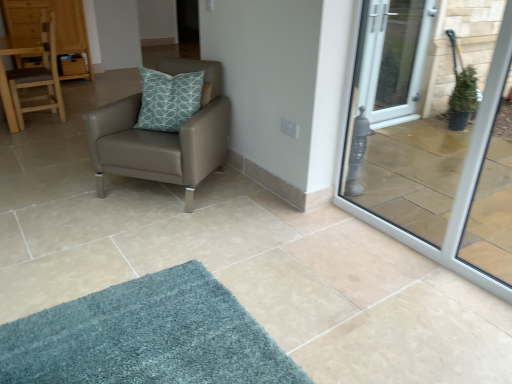
Describe the element at coordinates (31, 76) in the screenshot. I see `light brown wooden chair at left, the first chair in the left-to-right sequence` at that location.

Locate an element on the screen. wooden drawer at upper left is located at coordinates (73, 66).

Find the location of a particular element. matte brown leather chair at center, which appears as the second chair when viewed from the left is located at coordinates (162, 136).

Find the location of a particular element. This screenshot has width=512, height=384. transparent glass door at right is located at coordinates (460, 180).

In order to face transparent glass door at right, should I rotate leftwards or rightwards?

To face it directly, rotate right by 22.376 degrees.

Where is `light brown wooden chair at left, the first chair in the left-to-right sequence`? Image resolution: width=512 pixels, height=384 pixels. light brown wooden chair at left, the first chair in the left-to-right sequence is located at coordinates (31, 76).

Considering the points (47, 24) and (154, 149), which point is in front, point (47, 24) or point (154, 149)?

The point (154, 149) is closer to the camera.

Considering the sizes of objects light brown wooden chair at left, the first chair in the left-to-right sequence, and matte brown leather chair at center, which appears as the 2th chair when viewed from the back, in the image provided, who is smaller, light brown wooden chair at left, the first chair in the left-to-right sequence, or matte brown leather chair at center, which appears as the 2th chair when viewed from the back,?

light brown wooden chair at left, the first chair in the left-to-right sequence.

From a real-world perspective, which object rests below the other?

matte brown leather chair at center, positioned as the first chair in front-to-back order, from a real-world perspective.

Is light brown wooden chair at left, positioned as the second chair in front-to-back order, facing towards matte brown leather chair at center, which appears as the 2th chair when viewed from the back?

No.

Is light brown wooden chair at left, the first chair in the left-to-right sequence, not near wooden dresser at upper left?

No, light brown wooden chair at left, the first chair in the left-to-right sequence, is not far away from wooden dresser at upper left.

From a real-world perspective, is light brown wooden chair at left, the first chair in the left-to-right sequence, located beneath wooden dresser at upper left?

Correct, in the physical world, light brown wooden chair at left, the first chair in the left-to-right sequence, is lower than wooden dresser at upper left.

Considering the positions of point (9, 86) and point (38, 13), is point (9, 86) closer or farther from the camera than point (38, 13)?

Point (9, 86) appears to be closer to the viewer than point (38, 13).

From the image's perspective, is light brown wooden chair at left, the 2th chair in the right-to-left sequence, over wooden dresser at upper left?

Actually, light brown wooden chair at left, the 2th chair in the right-to-left sequence, appears below wooden dresser at upper left in the image.

From a real-world perspective, which is physically above, light brown wooden chair at left, the 1th chair positioned from the back, or wooden drawer at upper left?

From a 3D spatial view, light brown wooden chair at left, the 1th chair positioned from the back, is above.

Does point (24, 79) come in front of point (64, 71)?

Yes, it is.

Considering the relative sizes of light brown wooden chair at left, the first chair in the left-to-right sequence, and wooden drawer at upper left in the image provided, is light brown wooden chair at left, the first chair in the left-to-right sequence, taller than wooden drawer at upper left?

Correct, light brown wooden chair at left, the first chair in the left-to-right sequence, is much taller as wooden drawer at upper left.

Which object is more forward, light brown wooden chair at left, positioned as the second chair in front-to-back order, or wooden drawer at upper left?

light brown wooden chair at left, positioned as the second chair in front-to-back order.

From the image's perspective, is wooden drawer at upper left below matte brown leather chair at center, which appears as the 2th chair when viewed from the back?

No, from the image's perspective, wooden drawer at upper left is not beneath matte brown leather chair at center, which appears as the 2th chair when viewed from the back.

Can you confirm if wooden drawer at upper left is wider than matte brown leather chair at center, the 1th chair from the right?

No, wooden drawer at upper left is not wider than matte brown leather chair at center, the 1th chair from the right.

What's the angular difference between wooden drawer at upper left and matte brown leather chair at center, positioned as the first chair in front-to-back order,'s facing directions?

They differ by 54.4 degrees in their facing directions.

Looking at this image, which is farther from the camera, (x=76, y=69) or (x=176, y=138)?

The point (x=76, y=69) is behind.

Is wooden drawer at upper left turned away from light brown wooden chair at left, the 2th chair in the right-to-left sequence?

No.

Between point (79, 74) and point (58, 112), which one is positioned behind?

Point (79, 74)

Does wooden drawer at upper left appear on the left side of light brown wooden chair at left, the first chair in the left-to-right sequence?

→ Correct, you'll find wooden drawer at upper left to the left of light brown wooden chair at left, the first chair in the left-to-right sequence.

I want to click on the 1st chair positioned below the wooden drawer at upper left (from the image's perspective), so click(31, 76).

In the image, is light brown wooden chair at left, the 1th chair positioned from the back, positioned in front of or behind transparent glass door at right?

Visually, light brown wooden chair at left, the 1th chair positioned from the back, is located behind transparent glass door at right.

Can you confirm if light brown wooden chair at left, the first chair in the left-to-right sequence, is taller than transparent glass door at right?

In fact, light brown wooden chair at left, the first chair in the left-to-right sequence, may be shorter than transparent glass door at right.

Find the location of a particular element. This screenshot has width=512, height=384. chair that is the 2nd one when counting leftward from the transparent glass door at right is located at coordinates (31, 76).

Considering the positions of point (4, 101) and point (509, 46), is point (4, 101) closer or farther from the camera than point (509, 46)?

Point (4, 101) is farther from the camera than point (509, 46).

From their relative heights in the image, would you say wooden drawer at upper left is taller or shorter than wooden dresser at upper left?

Clearly, wooden drawer at upper left is shorter compared to wooden dresser at upper left.

From a real-world perspective, between wooden drawer at upper left and wooden dresser at upper left, who is vertically higher?

wooden dresser at upper left, from a real-world perspective.

What's the angular difference between wooden drawer at upper left and wooden dresser at upper left's facing directions?

The angle between the facing direction of wooden drawer at upper left and the facing direction of wooden dresser at upper left is 9.52e-05 degrees.

I want to click on drawer located behind the wooden dresser at upper left, so click(x=73, y=66).

The height and width of the screenshot is (384, 512). What are the coordinates of `chair located underneath the light brown wooden chair at left, the 1th chair positioned from the back (from a real-world perspective)` in the screenshot? It's located at click(x=162, y=136).

Locate an element on the screen. chair that is the 1st one when counting rightward from the wooden dresser at upper left is located at coordinates (31, 76).

From the image, which object appears to be nearer to transparent glass door at right, matte brown leather chair at center, the 1th chair from the right, or light brown wooden chair at left, the first chair in the left-to-right sequence?

matte brown leather chair at center, the 1th chair from the right, is positioned closer to the anchor transparent glass door at right.

Looking at the image, which one is located further to wooden dresser at upper left, wooden drawer at upper left or light brown wooden chair at left, the 1th chair positioned from the back?

light brown wooden chair at left, the 1th chair positioned from the back, is further to wooden dresser at upper left.

Based on their spatial positions, is light brown wooden chair at left, the first chair in the left-to-right sequence, or transparent glass door at right further from wooden drawer at upper left?

Based on the image, transparent glass door at right appears to be further to wooden drawer at upper left.

Estimate the real-world distances between objects in this image. Which object is further from wooden drawer at upper left, light brown wooden chair at left, the 1th chair positioned from the back, or matte brown leather chair at center, the 1th chair from the right?

matte brown leather chair at center, the 1th chair from the right, is further to wooden drawer at upper left.

Which object lies nearer to the anchor point light brown wooden chair at left, positioned as the second chair in front-to-back order, matte brown leather chair at center, which appears as the 2th chair when viewed from the back, or wooden drawer at upper left?

wooden drawer at upper left is closer to light brown wooden chair at left, positioned as the second chair in front-to-back order.

Looking at the image, which one is located closer to light brown wooden chair at left, the 2th chair in the right-to-left sequence, wooden dresser at upper left or wooden drawer at upper left?

wooden dresser at upper left.

When comparing their distances from light brown wooden chair at left, the 1th chair positioned from the back, does matte brown leather chair at center, which appears as the 2th chair when viewed from the back, or transparent glass door at right seem further?

Among the two, transparent glass door at right is located further to light brown wooden chair at left, the 1th chair positioned from the back.

When comparing their distances from transparent glass door at right, does wooden drawer at upper left or light brown wooden chair at left, the 1th chair positioned from the back, seem closer?

light brown wooden chair at left, the 1th chair positioned from the back.

Image resolution: width=512 pixels, height=384 pixels. What are the coordinates of `chair between matte brown leather chair at center, positioned as the first chair in front-to-back order, and wooden dresser at upper left, along the z-axis` in the screenshot? It's located at click(31, 76).

Locate an element on the screen. Image resolution: width=512 pixels, height=384 pixels. dresser located between light brown wooden chair at left, positioned as the second chair in front-to-back order, and wooden drawer at upper left in the depth direction is located at coordinates (56, 26).

Locate an element on the screen. Image resolution: width=512 pixels, height=384 pixels. dresser between matte brown leather chair at center, positioned as the first chair in front-to-back order, and wooden drawer at upper left in the front-back direction is located at coordinates pyautogui.click(x=56, y=26).

Find the location of a particular element. Image resolution: width=512 pixels, height=384 pixels. dresser between transparent glass door at right and wooden drawer at upper left from front to back is located at coordinates (56, 26).